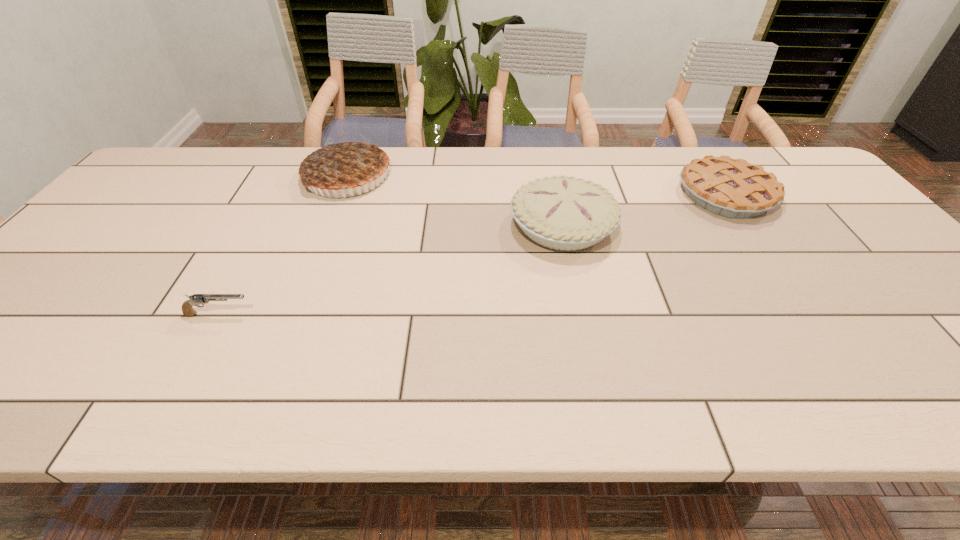
Locate an element on the screen. The width and height of the screenshot is (960, 540). the leftmost pie is located at coordinates (345, 163).

The width and height of the screenshot is (960, 540). Identify the location of the tallest object. (345, 163).

Find the location of `the second pie from left to right`. the second pie from left to right is located at coordinates (564, 213).

At what (x,y) coordinates should I click in order to perform the action: click on the second tallest object. Please return your answer as a coordinate pair (x, y). This screenshot has height=540, width=960. Looking at the image, I should click on (564, 213).

Where is `the shortest pie`? The width and height of the screenshot is (960, 540). the shortest pie is located at coordinates (733, 188).

At what (x,y) coordinates should I click in order to perform the action: click on the rightmost pie. Please return your answer as a coordinate pair (x, y). Image resolution: width=960 pixels, height=540 pixels. Looking at the image, I should click on (733, 188).

This screenshot has height=540, width=960. What are the coordinates of `gun` in the screenshot? It's located at (197, 299).

I want to click on vacant space located on the front of the tallest pie, so click(320, 247).

The height and width of the screenshot is (540, 960). What are the coordinates of `vacant space located on the front of the second shortest pie` in the screenshot? It's located at (588, 348).

Find the location of a particular element. The image size is (960, 540). free region located 0.050m on the right of the rightmost object is located at coordinates (790, 194).